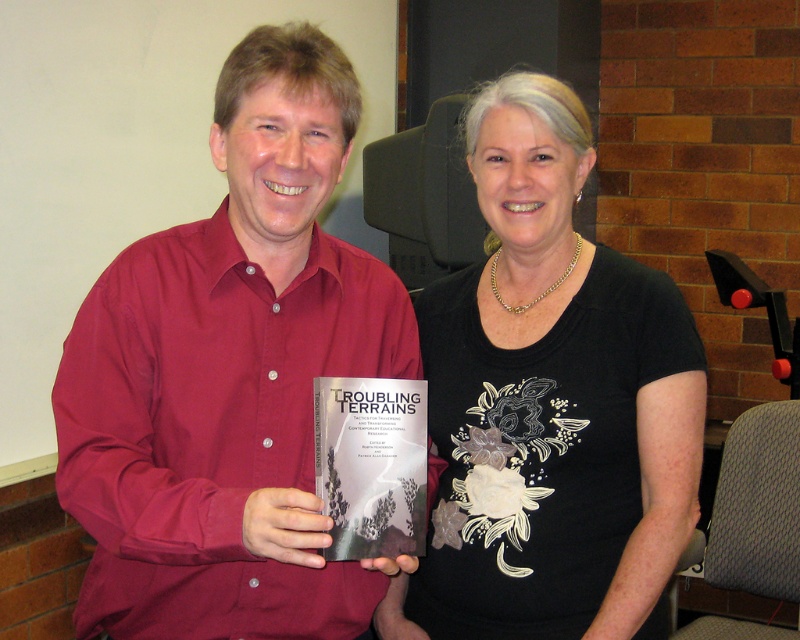
Question: Is matte red shirt at center to the left of matte gray book at center from the viewer's perspective?

Choices:
 (A) yes
 (B) no

Answer: (A)

Question: Considering the relative positions of matte red shirt at center and matte gray book at center in the image provided, where is matte red shirt at center located with respect to matte gray book at center?

Choices:
 (A) above
 (B) below

Answer: (A)

Question: Can you confirm if matte red shirt at center is thinner than black matte shirt at center?

Choices:
 (A) yes
 (B) no

Answer: (B)

Question: Based on their relative distances, which object is farther from the matte gray book at center?

Choices:
 (A) matte red shirt at center
 (B) black matte shirt at center

Answer: (B)

Question: Which object is farther from the camera taking this photo?

Choices:
 (A) black matte shirt at center
 (B) matte red shirt at center

Answer: (A)

Question: Which object appears farthest from the camera in this image?

Choices:
 (A) matte red shirt at center
 (B) black matte shirt at center

Answer: (B)